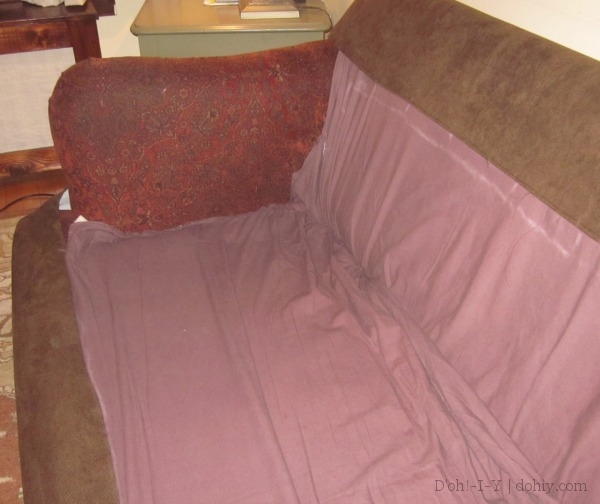
Where is `carpet`? This screenshot has width=600, height=504. carpet is located at coordinates (15, 461).